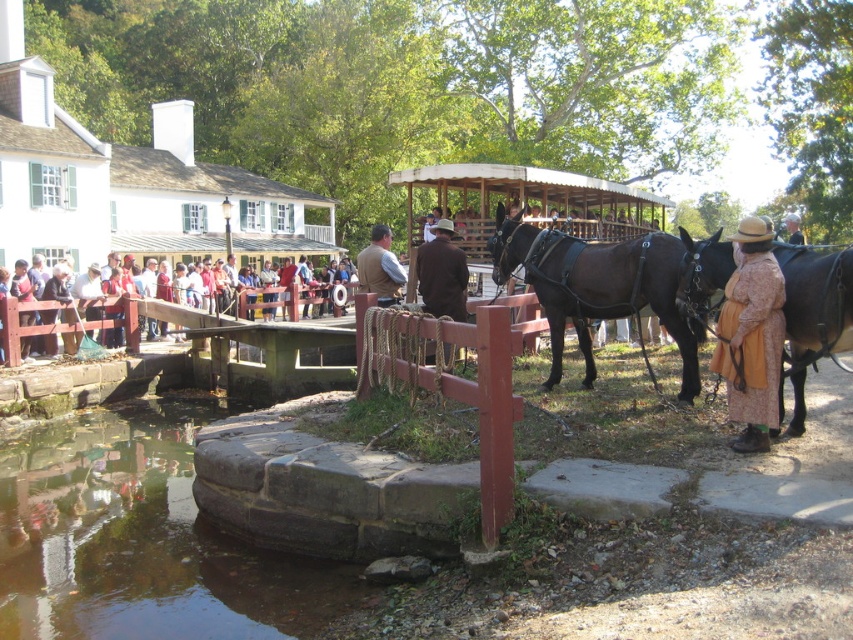
Question: Is red shirt at center below brown leather vest at center?

Choices:
 (A) no
 (B) yes

Answer: (B)

Question: Is clear water at bridge lower behind red shirt at center?

Choices:
 (A) no
 (B) yes

Answer: (A)

Question: Is clear water at bridge lower wider than brown leather vest at center?

Choices:
 (A) no
 (B) yes

Answer: (A)

Question: Among these points, which one is farthest from the camera?

Choices:
 (A) (785, 216)
 (B) (749, 396)

Answer: (A)

Question: Which point is closer to the camera taking this photo?

Choices:
 (A) (216, 545)
 (B) (384, 275)
 (C) (509, 237)
 (D) (802, 241)

Answer: (A)

Question: Which point is farther to the camera?

Choices:
 (A) (749, 307)
 (B) (132, 308)

Answer: (B)